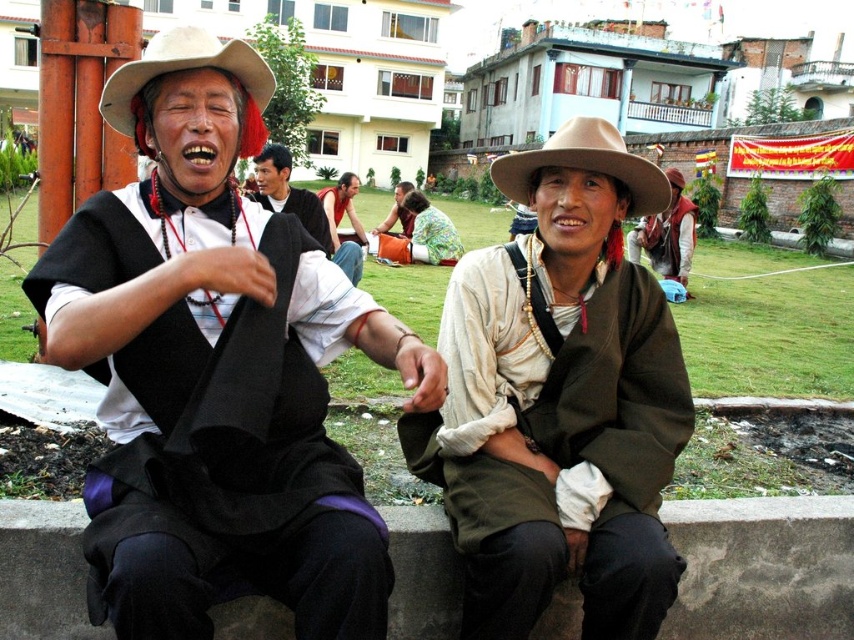
Question: Does matte brown jacket at center appear over concrete at lower center?

Choices:
 (A) yes
 (B) no

Answer: (A)

Question: Is matte black vest at left above matte black tie at center?

Choices:
 (A) yes
 (B) no

Answer: (B)

Question: Which point is closer to the camera?

Choices:
 (A) matte brown jacket at center
 (B) concrete at lower center
 (C) green fabric jacket at center
 (D) matte black tie at center

Answer: (A)

Question: Which of these objects is positioned farthest from the concrete at lower center?

Choices:
 (A) brown felt cowboy hat at center
 (B) matte black vest at left

Answer: (B)

Question: Can you confirm if concrete at lower center is wider than matte black tie at center?

Choices:
 (A) no
 (B) yes

Answer: (A)

Question: Among these points, which one is nearest to the camera?

Choices:
 (A) (554, 163)
 (B) (279, 147)
 (C) (395, 218)
 (D) (288, 358)

Answer: (D)